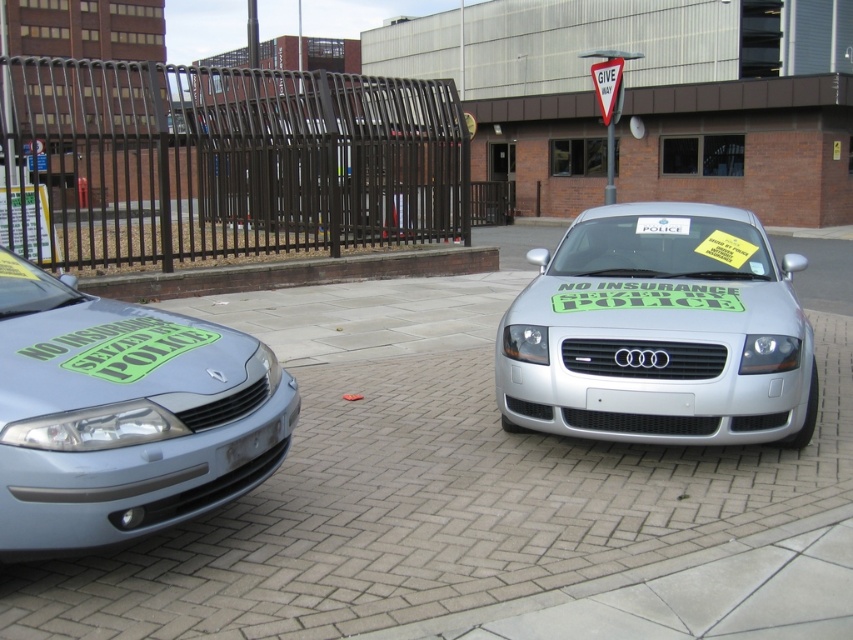
Does brick paved at center have a lesser height compared to green matte sticker at center?

Incorrect, brick paved at center's height does not fall short of green matte sticker at center's.

Is point (282, 589) farther from viewer compared to point (654, 307)?

No, (282, 589) is in front of (654, 307).

Identify the location of brick paved at center. (424, 484).

Looking at this image, who is higher up, matte silver car at left or white plastic sign at center?

Positioned higher is white plastic sign at center.

Is matte silver car at left above white plastic sign at center?

No.

You are a GUI agent. You are given a task and a screenshot of the screen. Output one action in this format:
    pyautogui.click(x=<x>, y=<y>)
    Task: Click on the matte silver car at left
    The image size is (853, 640).
    Given the screenshot: What is the action you would take?
    pyautogui.click(x=125, y=413)

In the scene shown: Between green matte sticker at center and white plastic sign at center, which one appears on the right side from the viewer's perspective?

From the viewer's perspective, white plastic sign at center appears more on the right side.

Does green matte sticker at center have a lesser width compared to white plastic sign at center?

In fact, green matte sticker at center might be wider than white plastic sign at center.

Between point (712, 294) and point (640, 225), which one is positioned in front?

Positioned in front is point (712, 294).

Identify the location of green matte sticker at center. 643,296.